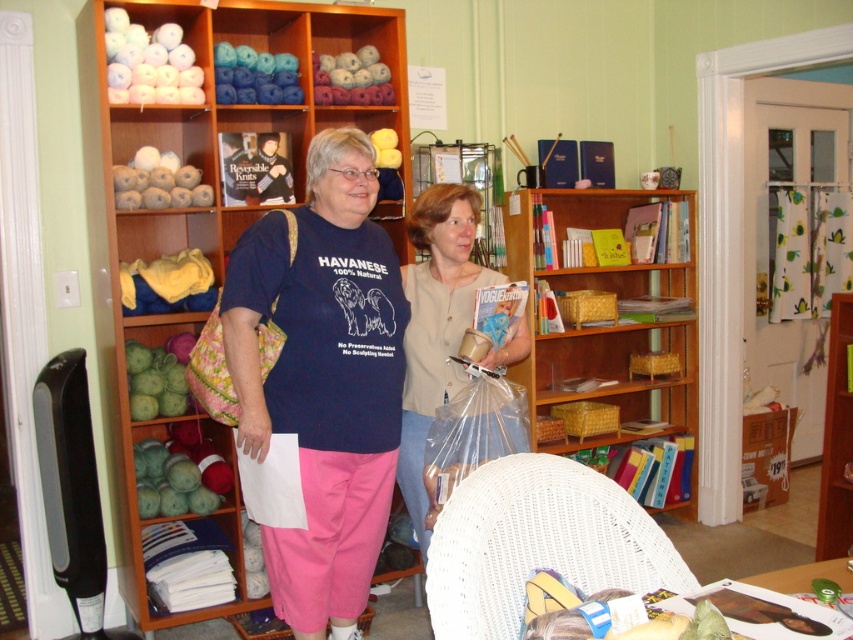
Is clear plastic bag at lower center below wooden bookshelf at right?

No.

Can you confirm if clear plastic bag at lower center is shorter than wooden bookshelf at right?

Yes.

What are the coordinates of `clear plastic bag at lower center` in the screenshot? It's located at (473, 433).

In the scene shown: Is wooden bookshelf at left further to the viewer compared to beige fabric sweater at center?

→ Yes.

Between point (401, 100) and point (454, 376), which one is positioned behind?

Positioned behind is point (401, 100).

Is point (103, 99) less distant than point (408, 493)?

No, it is behind (408, 493).

Where is `wooden bookshelf at left`? wooden bookshelf at left is located at coordinates (194, 205).

Locate an element on the screen. This screenshot has width=853, height=640. matte blue t-shirt with dog print at center is located at coordinates (323, 380).

Describe the element at coordinates (323, 380) in the screenshot. I see `matte blue t-shirt with dog print at center` at that location.

Which is in front, point (376, 282) or point (511, 445)?

Positioned in front is point (376, 282).

This screenshot has height=640, width=853. What are the coordinates of `matte blue t-shirt with dog print at center` in the screenshot? It's located at (323, 380).